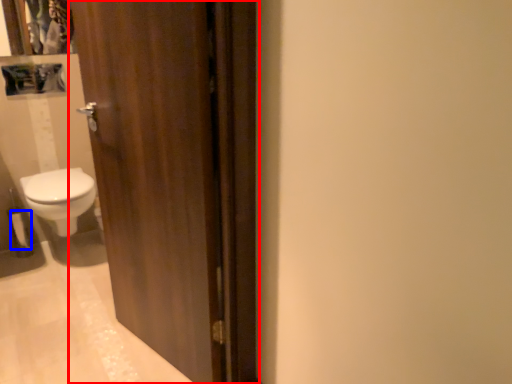
Question: Which of the following is the farthest to the observer, door (highlighted by a red box) or toilet paper (highlighted by a blue box)?

Choices:
 (A) door
 (B) toilet paper

Answer: (B)